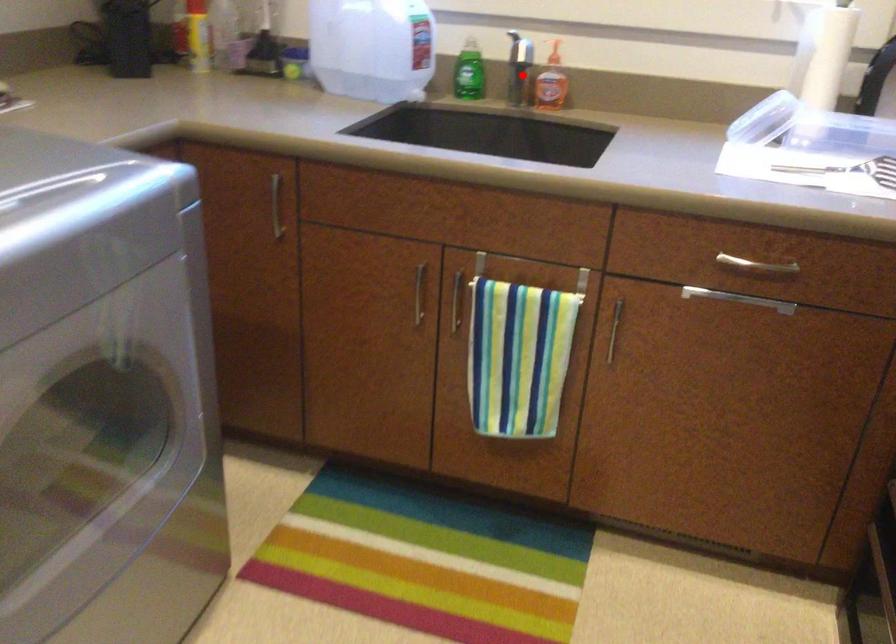
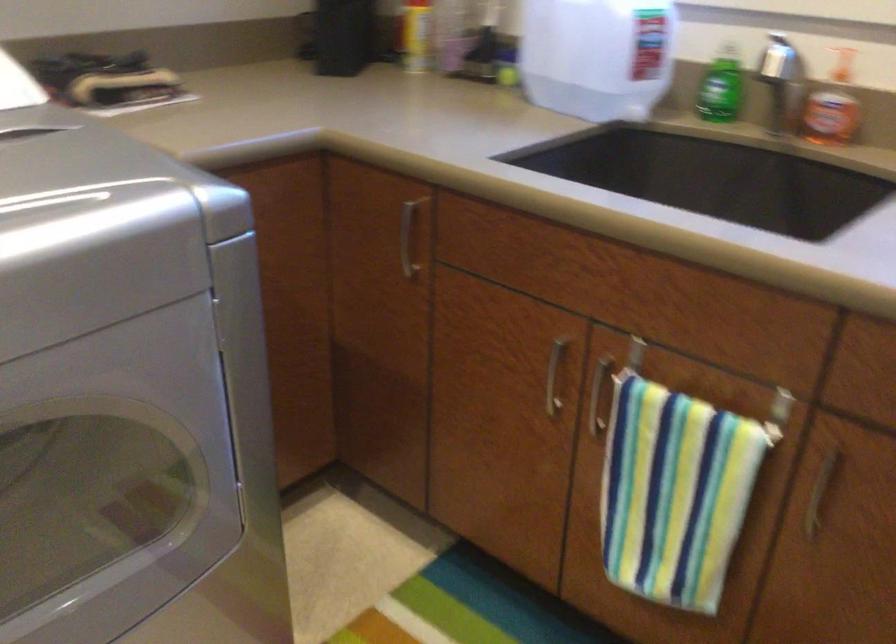
Question: I am providing you with two images of the same scene from different viewpoints. In image1, a red point is highlighted. Considering the same 3D point in image2, which of the following is correct?

Choices:
 (A) It is closer
 (B) It is farther

Answer: (A)